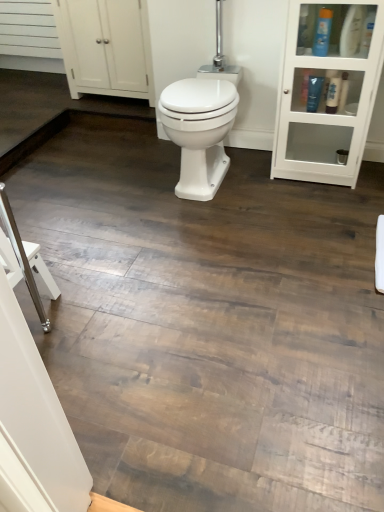
This screenshot has width=384, height=512. I want to click on free space in front of white glass cabinet at upper right, so click(x=318, y=205).